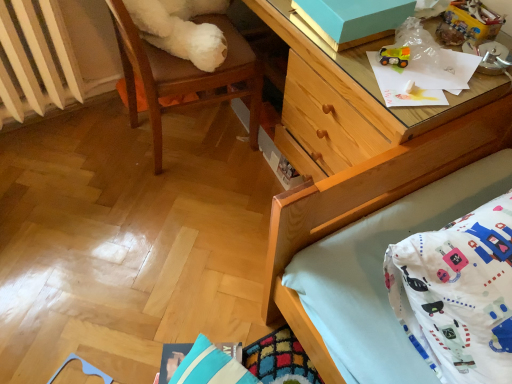
Question: Is wooden desk at upper right inside or outside of rubberized yellow toy truck at upper right, the 1th toy from the bottom?

Choices:
 (A) inside
 (B) outside

Answer: (B)

Question: Is wooden desk at upper right taller or shorter than rubberized yellow toy truck at upper right, the 1th toy from the bottom?

Choices:
 (A) tall
 (B) short

Answer: (A)

Question: Which of these objects is positioned closest to the matte blue cardboard box at upper right?

Choices:
 (A) wooden desk at upper right
 (B) plastic toy car at upper right, the first toy from the right
 (C) white plastic radiator at left
 (D) rubberized yellow toy truck at upper right, acting as the 2th toy starting from the top
 (E) blue striped pillow at lower center

Answer: (D)

Question: Which object is the closest to the wooden chair at upper left?

Choices:
 (A) wooden desk at upper right
 (B) blue striped pillow at lower center
 (C) white plastic radiator at left
 (D) matte blue cardboard box at upper right
 (E) plastic toy car at upper right, the 1th toy in the top-to-bottom sequence

Answer: (C)